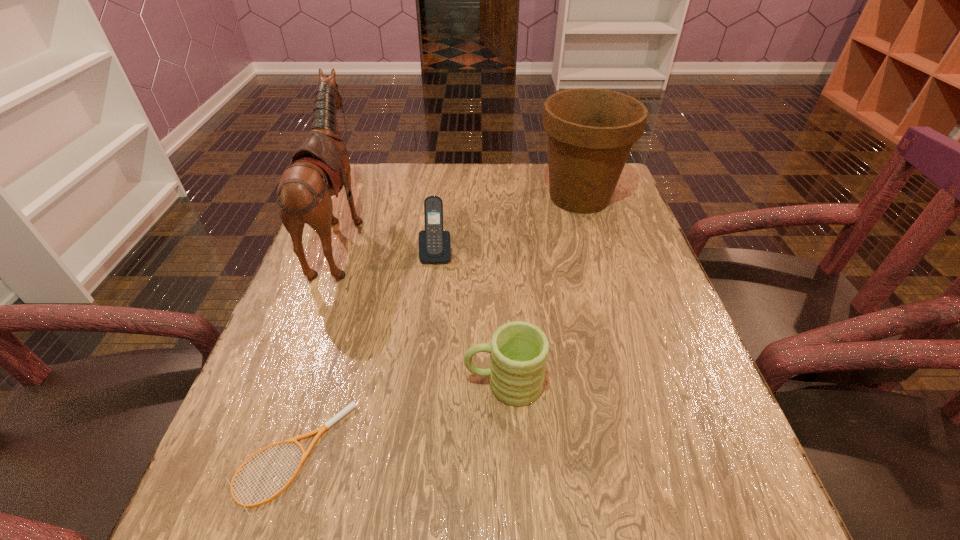
At what (x,y) coordinates should I click in order to perform the action: click on object at the right edge. Please return your answer as a coordinate pair (x, y). This screenshot has height=540, width=960. Looking at the image, I should click on (591, 131).

You are a GUI agent. You are given a task and a screenshot of the screen. Output one action in this format:
    pyautogui.click(x=<x>, y=<y>)
    Task: Click on the object that is at the far left corner
    This screenshot has width=960, height=540.
    Given the screenshot: What is the action you would take?
    pyautogui.click(x=320, y=167)

Where is `object that is at the near left corner`? The height and width of the screenshot is (540, 960). object that is at the near left corner is located at coordinates (352, 405).

The height and width of the screenshot is (540, 960). What are the coordinates of `object that is positioned at the far right corner` in the screenshot? It's located at (591, 131).

Locate an element on the screen. The image size is (960, 540). free space at the far edge of the desktop is located at coordinates (483, 197).

This screenshot has width=960, height=540. Find the location of `blank space at the near edge of the desktop`. blank space at the near edge of the desktop is located at coordinates (432, 515).

Where is `free space at the left edge of the desktop`? Image resolution: width=960 pixels, height=540 pixels. free space at the left edge of the desktop is located at coordinates (296, 305).

Find the location of a particular element. The width and height of the screenshot is (960, 540). vacant region at the right edge is located at coordinates (624, 321).

Locate an element on the screen. The image size is (960, 540). free space at the far left corner is located at coordinates (370, 188).

The height and width of the screenshot is (540, 960). In the image, there is a desktop. What are the coordinates of `free space at the near left corner` in the screenshot? It's located at (224, 530).